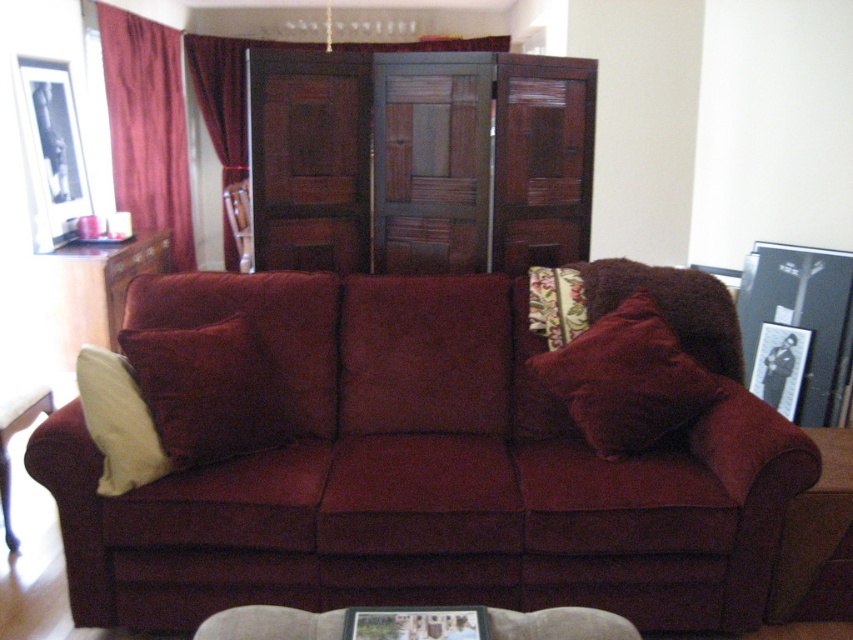
You are arranging a new plant stand in the living room and want to place it between the black matte picture frame at upper left and the velvet burgundy curtain at left. Since the plant stand is 1.2 meters tall, will it fit vertically between them?

The black matte picture frame at upper left is below the velvet burgundy curtain at left, so there is vertical space between them. However, the description does not specify the exact distance between them, so it is uncertain if the 1.2 meter tall plant stand will fit vertically between them.

In the scene shown: You are arranging a photo shoot in the living room. You have two items to position properly. The velvet yellow pillow at left and the burgundy velvet curtain at left. The photographer wants to ensure that the curtain is taller than the pillow in the shot. Is this requirement already satisfied?

The velvet yellow pillow at left is not as tall as the burgundy velvet curtain at left, so the requirement is already satisfied because the curtain is taller than the pillow.

You are standing in the living room and want to place a small plant between the two points, point (38, 164) and point (194, 92). Which point should the plant be closer to if you want it to be closer to the sofa?

The plant should be closer to point (38, 164) because it is in front of point (194, 92), meaning it is nearer to the sofa.